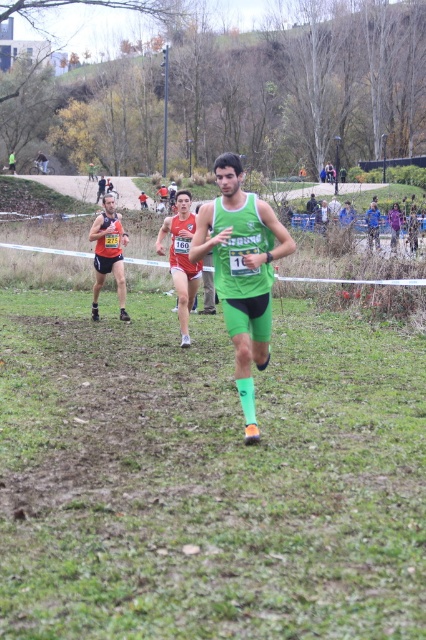
Does point (267, 266) lie in front of point (120, 292)?

Yes, it is in front of point (120, 292).

Is point (247, 259) less distant than point (104, 212)?

Yes, point (247, 259) is closer to viewer.

At what (x,y) coordinates should I click in order to perform the action: click on green matte triathlon suit at center. Please return your answer as a coordinate pair (x, y). This screenshot has width=426, height=640. Looking at the image, I should click on (241, 272).